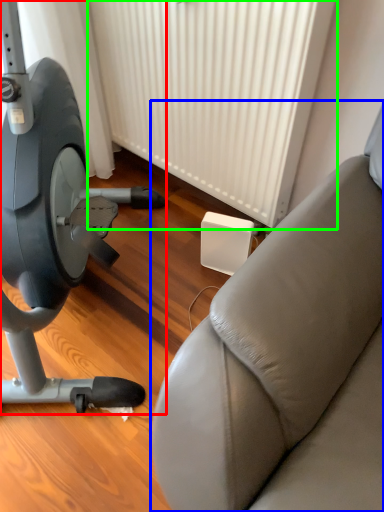
Question: Which is nearer to the stationary bicycle (highlighted by a red box)? studio couch (highlighted by a blue box) or radiator (highlighted by a green box).

Choices:
 (A) studio couch
 (B) radiator

Answer: (B)